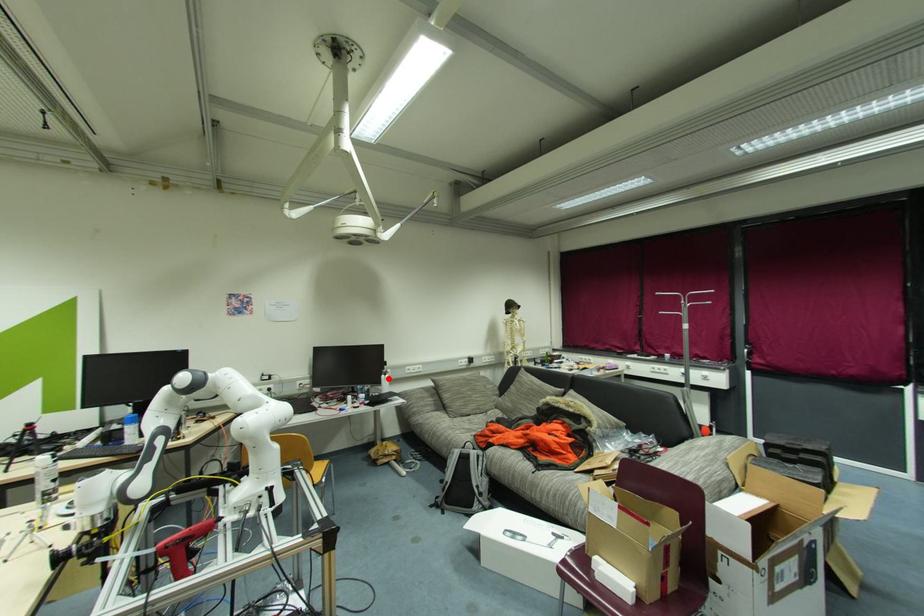
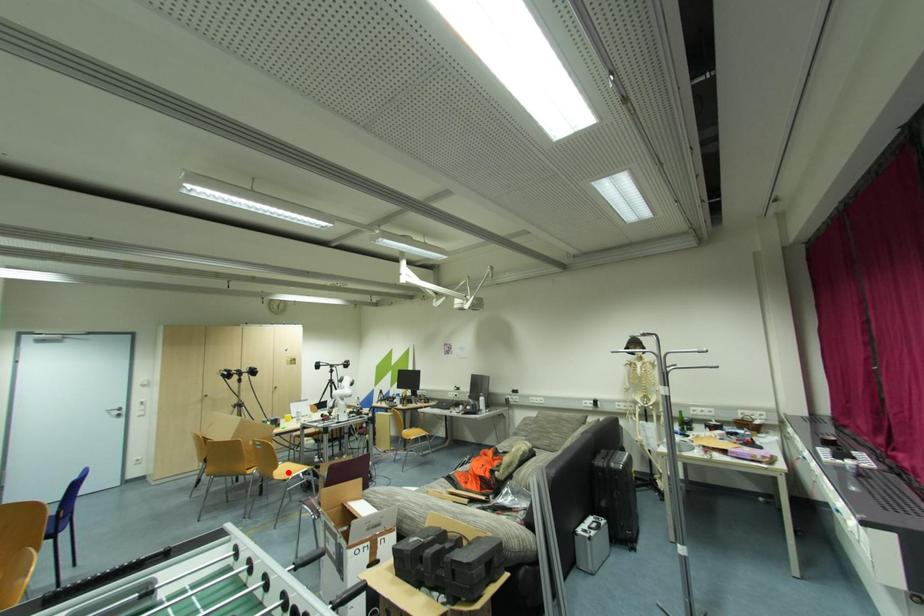
I am providing you with two images of the same scene from different viewpoints. A red point is marked on the first image and another point is marked on the second image. Are the points marked in image1 and image2 representing the same 3D position?

No